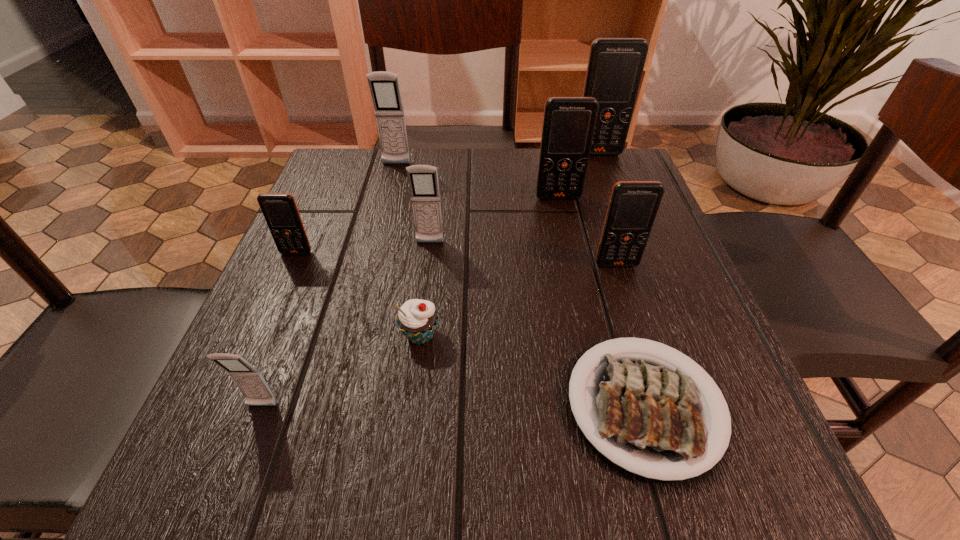
You are a GUI agent. You are given a task and a screenshot of the screen. Output one action in this format:
    pyautogui.click(x=<x>, y=<y>)
    Task: Click on the orange cellular telephone that stands as the second closest to the second farthest cellular telephone
    The image size is (960, 540).
    Given the screenshot: What is the action you would take?
    pyautogui.click(x=569, y=123)

Select which orange cellular telephone appears as the second closest to the second shortest object. Please provide its 2D coordinates. Your answer should be formatted as a tuple, i.e. [(x, y)], where the tuple contains the x and y coordinates of a point satisfying the conditions above.

[(633, 206)]

This screenshot has height=540, width=960. In order to click on gray cellular telephone that stands as the closest to the third farthest cellular telephone in this screenshot , I will do `click(423, 180)`.

Locate which gray cellular telephone is the second closest to the second farthest gray cellular telephone. Please provide its 2D coordinates. Your answer should be formatted as a tuple, i.e. [(x, y)], where the tuple contains the x and y coordinates of a point satisfying the conditions above.

[(249, 380)]

Where is `free spot that satisfies the following two spatial constraints: 1. on the screen of the plate; 2. on the left side of the second farthest orange cellular telephone`? The width and height of the screenshot is (960, 540). free spot that satisfies the following two spatial constraints: 1. on the screen of the plate; 2. on the left side of the second farthest orange cellular telephone is located at coordinates (604, 406).